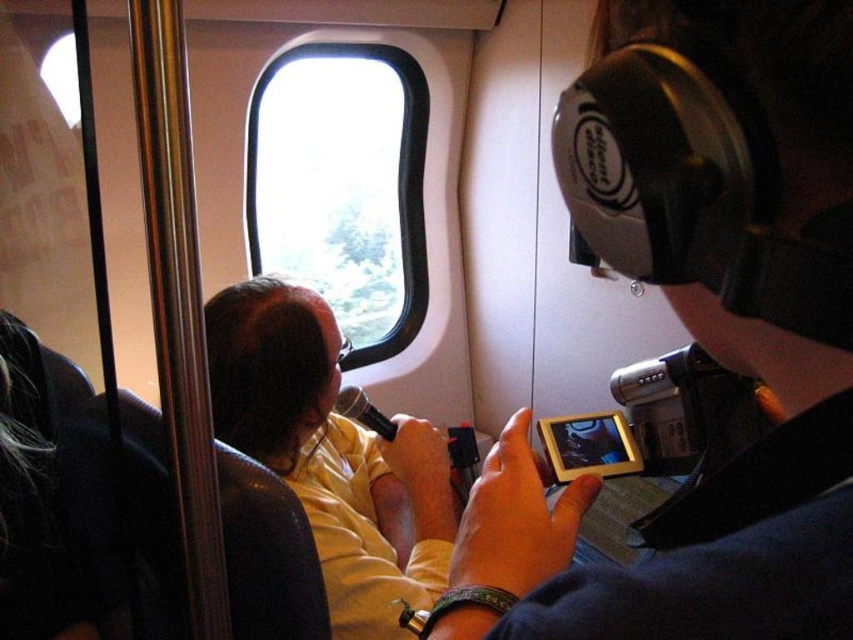
You are a passenger on an airplane and want to watch the sunset through the window. You see the silent disco headphones at upper right and the transparent glass airplane window at upper center. Which object should you move away from to have an unobstructed view of the window?

The silent disco headphones at upper right is to the right of the transparent glass airplane window at upper center, so you should move away from the silent disco headphones at upper right to have an unobstructed view of the window.

You are a passenger sitting in the train and you want to borrow the silent disco headphones at upper right from the person wearing the yellow matte shirt at center. Can you reach them without getting up from your seat?

The silent disco headphones at upper right are above the yellow matte shirt at center, so they are positioned higher up. Since you are seated, you might need to stretch your arm upwards to reach them, but it might be challenging without getting up.

What object is located at the point with coordinates (653, 563) in the image?

The silent disco headphones at upper right are located at point (653, 563).